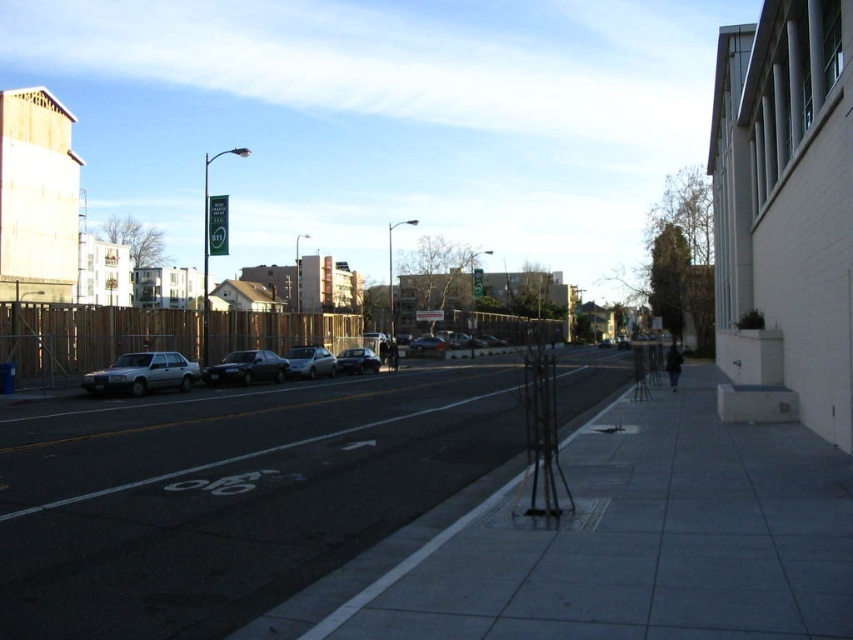
Question: Which object appears farthest from the camera in this image?

Choices:
 (A) dark asphalt road at center
 (B) satin silver sedan at center

Answer: (B)

Question: Can you confirm if gray concrete sidewalk at center is thinner than shiny silver sedan at center?

Choices:
 (A) no
 (B) yes

Answer: (A)

Question: Is green plastic sign at upper center smaller than shiny silver sedan at center?

Choices:
 (A) no
 (B) yes

Answer: (A)

Question: Can you confirm if dark asphalt road at center is positioned above gray concrete sidewalk at center?

Choices:
 (A) no
 (B) yes

Answer: (A)

Question: Which of the following is the farthest from the observer?

Choices:
 (A) green plastic sign at upper center
 (B) shiny silver sedan at center
 (C) silver metallic sedan at center
 (D) shiny black sedan at center

Answer: (B)

Question: Which object appears farthest from the camera in this image?

Choices:
 (A) shiny black sedan at center
 (B) gray concrete sidewalk at center
 (C) satin silver sedan at center

Answer: (C)